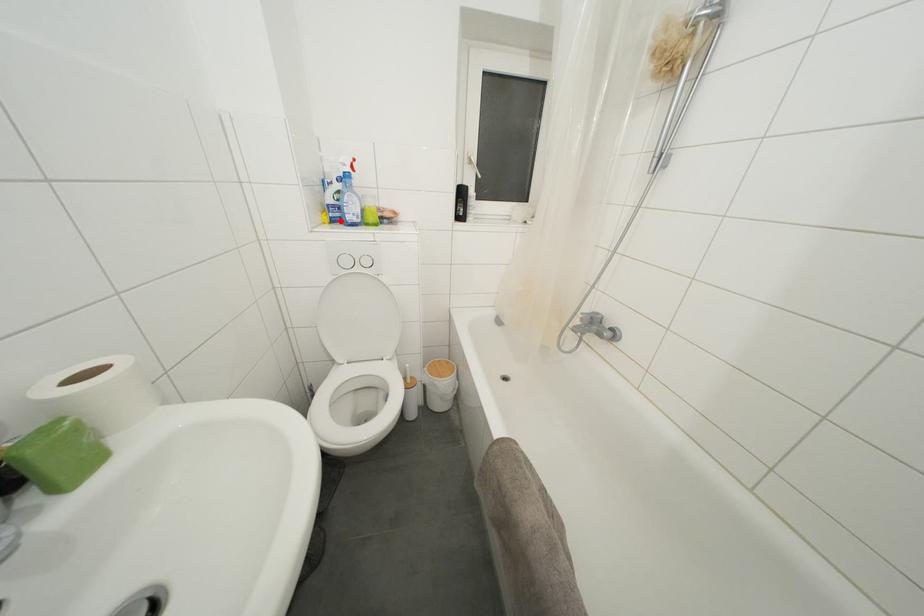
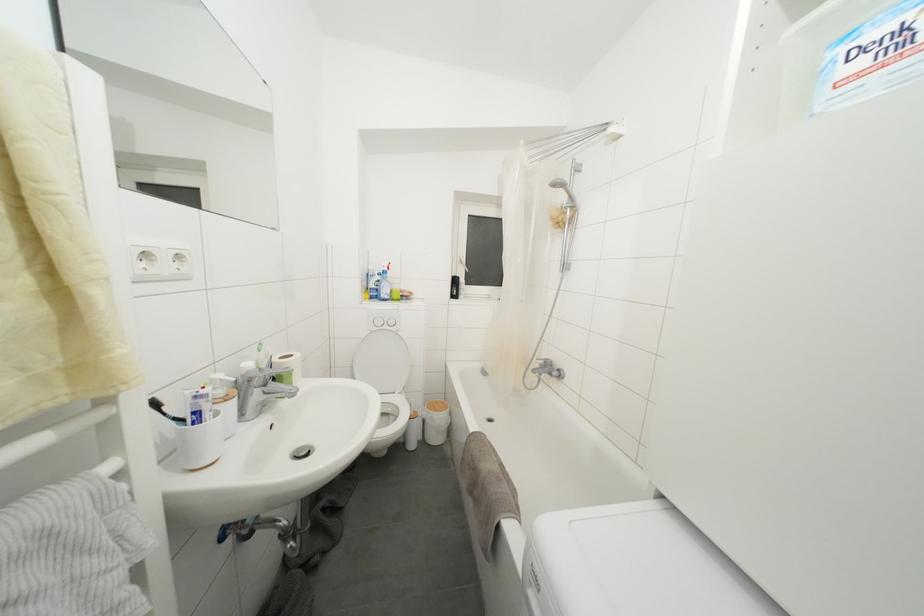
Question: I am providing you with two images of the same scene from different viewpoints. A red point is marked on the first image. Is the red point's position out of view in image 2?

Choices:
 (A) Yes
 (B) No

Answer: (B)